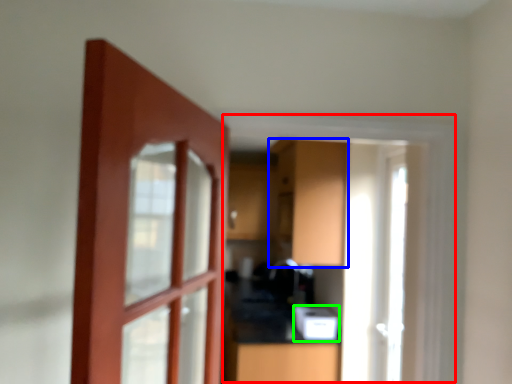
Question: Which object is positioned farthest from window frame (highlighted by a red box)? Select from cabinetry (highlighted by a blue box) and appliance (highlighted by a green box).

Choices:
 (A) cabinetry
 (B) appliance

Answer: (B)